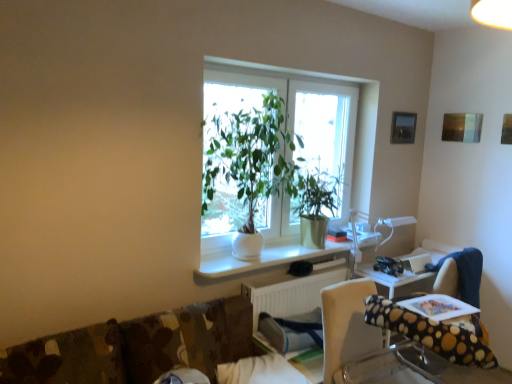
Question: Does white ceramic plant at center appear on the left side of white plastic radiator at lower center?

Choices:
 (A) yes
 (B) no

Answer: (A)

Question: Is white ceramic plant at center shorter than white plastic radiator at lower center?

Choices:
 (A) no
 (B) yes

Answer: (A)

Question: From a real-world perspective, is white ceramic plant at center below white plastic radiator at lower center?

Choices:
 (A) yes
 (B) no

Answer: (B)

Question: Can you confirm if white ceramic plant at center is taller than white plastic radiator at lower center?

Choices:
 (A) yes
 (B) no

Answer: (A)

Question: Could you tell me if white ceramic plant at center is facing white plastic radiator at lower center?

Choices:
 (A) no
 (B) yes

Answer: (A)

Question: Is point (303, 195) positioned closer to the camera than point (352, 357)?

Choices:
 (A) farther
 (B) closer

Answer: (A)

Question: Is green matte plant at center to the left or to the right of polka dot fabric chair at lower right in the image?

Choices:
 (A) left
 (B) right

Answer: (A)

Question: In terms of size, does green matte plant at center appear bigger or smaller than polka dot fabric chair at lower right?

Choices:
 (A) big
 (B) small

Answer: (B)

Question: Is green matte plant at center wider or thinner than polka dot fabric chair at lower right?

Choices:
 (A) wide
 (B) thin

Answer: (B)

Question: Considering the positions of polka dot fabric chair at lower right and green matte plant at center in the image, is polka dot fabric chair at lower right wider or thinner than green matte plant at center?

Choices:
 (A) wide
 (B) thin

Answer: (A)

Question: From their relative heights in the image, would you say polka dot fabric chair at lower right is taller or shorter than green matte plant at center?

Choices:
 (A) short
 (B) tall

Answer: (B)

Question: From the image's perspective, is polka dot fabric chair at lower right above or below green matte plant at center?

Choices:
 (A) above
 (B) below

Answer: (B)

Question: Is point (336, 319) closer or farther from the camera than point (342, 178)?

Choices:
 (A) closer
 (B) farther

Answer: (A)

Question: Considering the positions of point (241, 261) and point (359, 377), is point (241, 261) closer or farther from the camera than point (359, 377)?

Choices:
 (A) farther
 (B) closer

Answer: (A)

Question: Would you say white glossy computer desk at center is inside or outside polka dot fabric chair at lower right?

Choices:
 (A) outside
 (B) inside

Answer: (A)